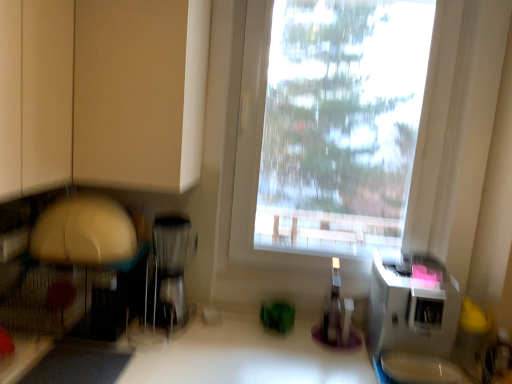
Question: In terms of height, does transparent plastic bottle at center look taller or shorter compared to satin silver coffee maker at center, the first appliance when ordered from left to right?

Choices:
 (A) tall
 (B) short

Answer: (B)

Question: Considering the positions of transparent plastic bottle at center and satin silver coffee maker at center, marked as the second appliance in a right-to-left arrangement, in the image, is transparent plastic bottle at center bigger or smaller than satin silver coffee maker at center, marked as the second appliance in a right-to-left arrangement,?

Choices:
 (A) big
 (B) small

Answer: (B)

Question: Estimate the real-world distances between objects in this image. Which object is farther from the white plastic microwave at right, arranged as the second appliance when viewed from the left?

Choices:
 (A) transparent plastic bottle at center
 (B) matte beige cabinet at upper left
 (C) satin silver coffee maker at center, marked as the second appliance in a right-to-left arrangement
 (D) transparent plastic window at center

Answer: (B)

Question: Which object is positioned farthest from the transparent plastic window at center?

Choices:
 (A) satin silver coffee maker at center, marked as the second appliance in a right-to-left arrangement
 (B) matte beige cabinet at upper left
 (C) transparent plastic bottle at center
 (D) white plastic microwave at right, which ranks as the first appliance in right-to-left order

Answer: (B)